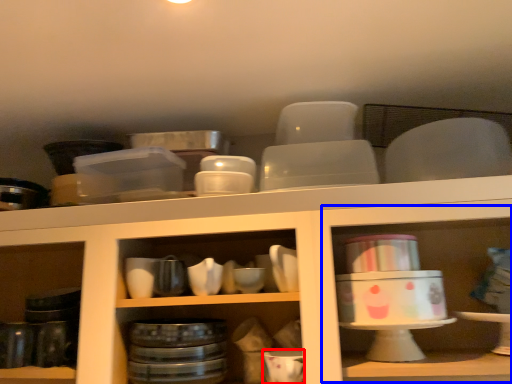
Question: Among these objects, which one is nearest to the camera, tableware (highlighted by a red box) or shelf (highlighted by a blue box)?

Choices:
 (A) tableware
 (B) shelf

Answer: (B)